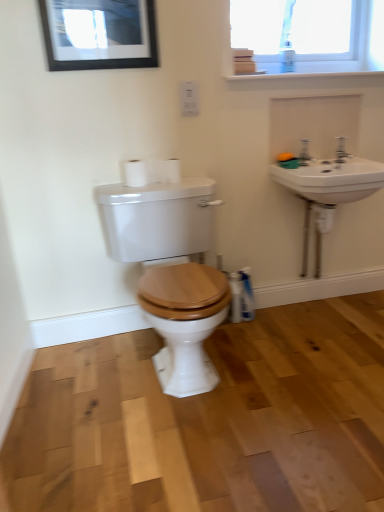
This screenshot has width=384, height=512. In order to click on vacant space that's between wooden toilet seat at center and white plastic bottle at lower right in this screenshot , I will do `click(250, 350)`.